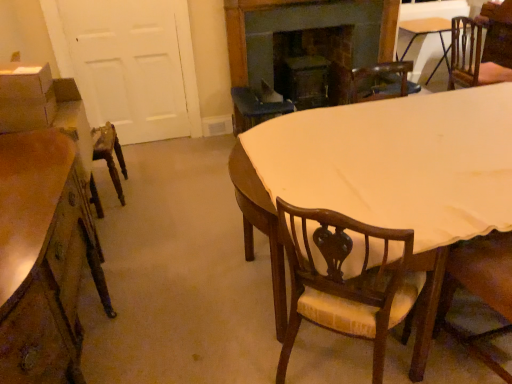
Question: Is light brown wooden table at center thinner than dark wood fireplace at upper center?

Choices:
 (A) yes
 (B) no

Answer: (B)

Question: Does light brown wooden table at center appear on the left side of dark wood fireplace at upper center?

Choices:
 (A) no
 (B) yes

Answer: (A)

Question: From a real-world perspective, does light brown wooden table at center stand above dark wood fireplace at upper center?

Choices:
 (A) yes
 (B) no

Answer: (B)

Question: Is light brown wooden table at center facing away from dark wood fireplace at upper center?

Choices:
 (A) no
 (B) yes

Answer: (A)

Question: Is light brown wooden table at center outside dark wood fireplace at upper center?

Choices:
 (A) no
 (B) yes

Answer: (B)

Question: Looking at the image, does light brown wooden table at center seem bigger or smaller compared to dark wood fireplace at upper center?

Choices:
 (A) small
 (B) big

Answer: (B)

Question: In the image, is light brown wooden table at center on the left side or the right side of dark wood fireplace at upper center?

Choices:
 (A) left
 (B) right

Answer: (B)

Question: Does point (510, 130) appear closer or farther from the camera than point (279, 9)?

Choices:
 (A) closer
 (B) farther

Answer: (A)

Question: From the image's perspective, is light brown wooden table at center positioned above or below dark wood fireplace at upper center?

Choices:
 (A) below
 (B) above

Answer: (A)

Question: Is dark wood fireplace at upper center inside the boundaries of wooden chair with cushion at lower right, placed as the first chair when sorted from front to back, or outside?

Choices:
 (A) outside
 (B) inside

Answer: (A)

Question: In terms of size, does dark wood fireplace at upper center appear bigger or smaller than wooden chair with cushion at lower right, which is the 2th chair in top-to-bottom order?

Choices:
 (A) small
 (B) big

Answer: (A)

Question: From a real-world perspective, is dark wood fireplace at upper center physically located above or below wooden chair with cushion at lower right, the second chair positioned from the left?

Choices:
 (A) below
 (B) above

Answer: (B)

Question: Visually, is dark wood fireplace at upper center positioned to the left or to the right of wooden chair with cushion at lower right, the second chair positioned from the left?

Choices:
 (A) right
 (B) left

Answer: (B)

Question: From a real-world perspective, is brown wood chair at upper right, the 3th chair from the front, above or below white matte door at left?

Choices:
 (A) below
 (B) above

Answer: (A)

Question: From the image's perspective, is brown wood chair at upper right, the 3th chair from the front, above or below white matte door at left?

Choices:
 (A) below
 (B) above

Answer: (B)